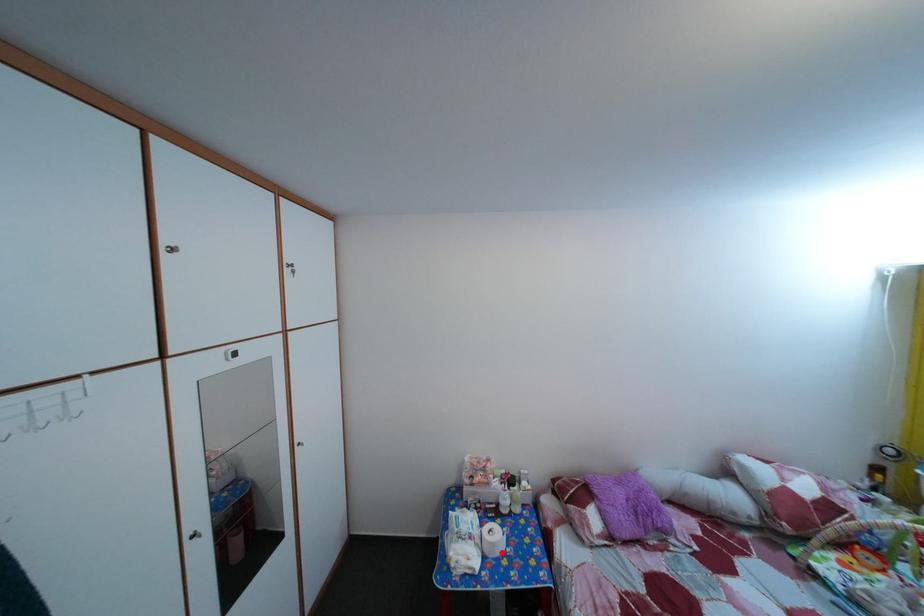
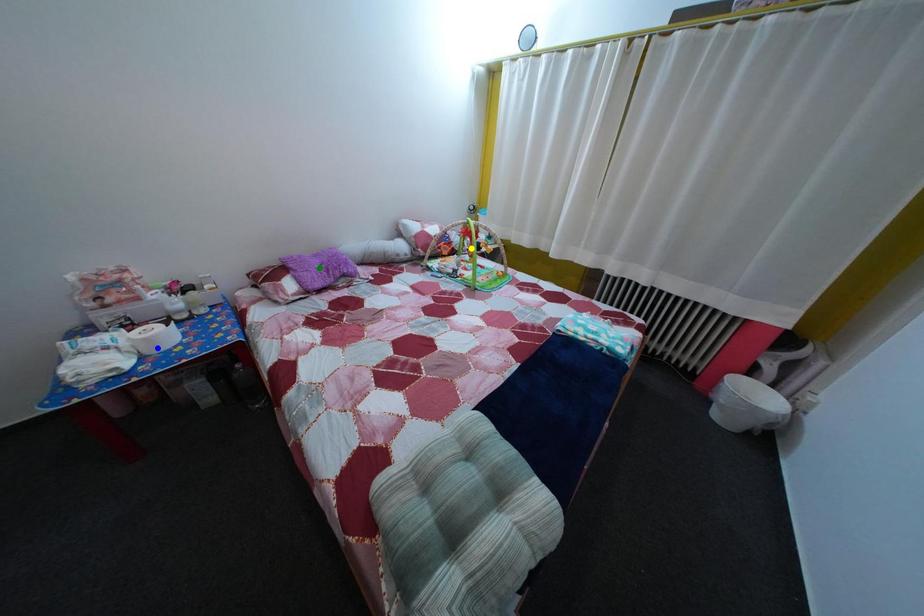
Question: I am providing you with two images of the same scene from different viewpoints. A red point is marked on the first image. You are given multiple points on the second image. Which spot in image 2 lines up with the point in image 1?

Choices:
 (A) yellow point
 (B) blue point
 (C) green point

Answer: (B)